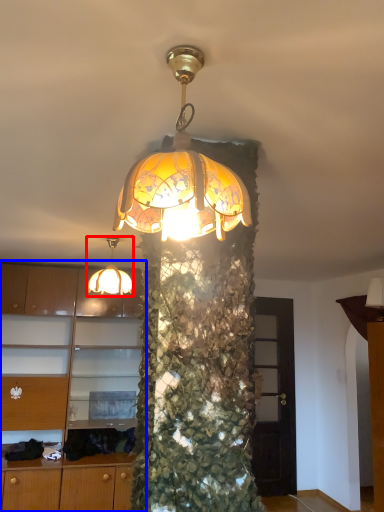
Question: Among these objects, which one is farthest to the camera, lamp (highlighted by a red box) or cabinetry (highlighted by a blue box)?

Choices:
 (A) lamp
 (B) cabinetry

Answer: (B)